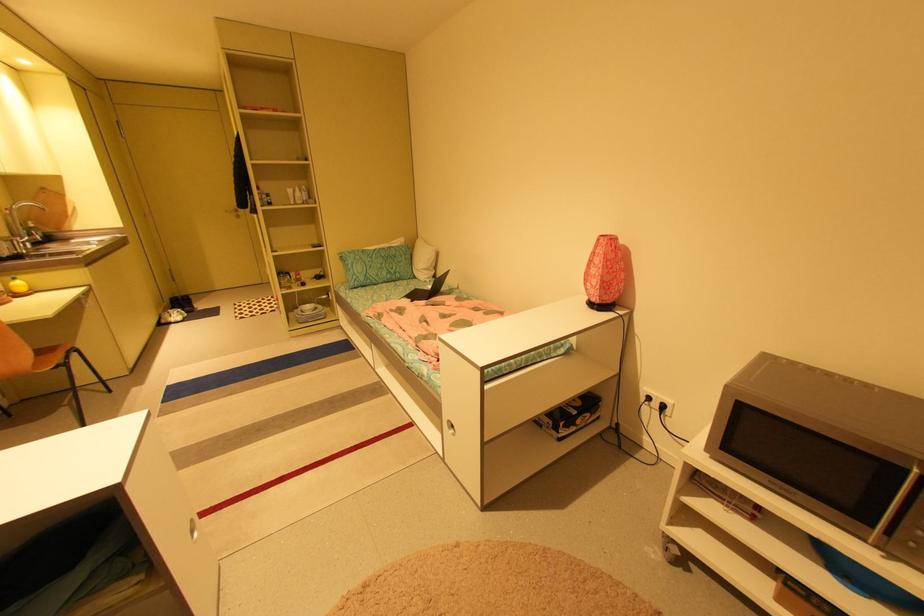
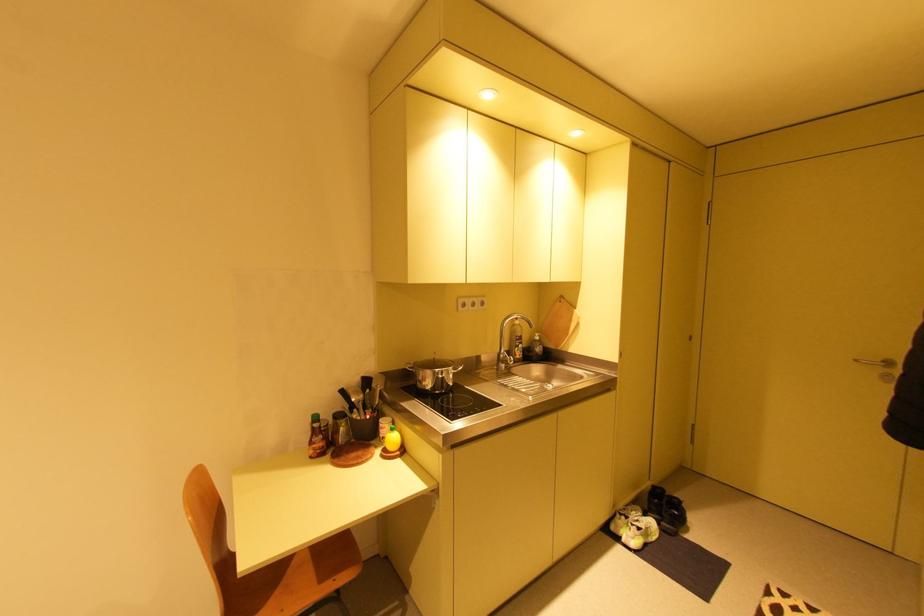
Locate, in the second image, the point that corresponds to the point at 33,224 in the first image.

(541, 336)